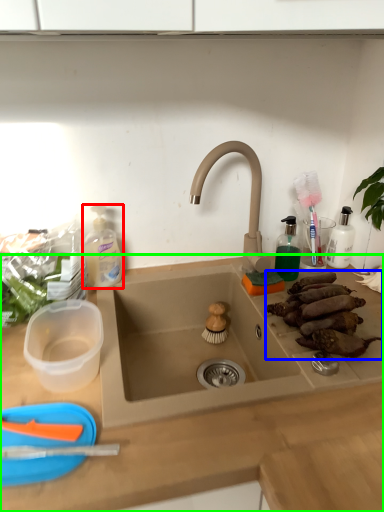
Question: Which is nearer to the cleaning product (highlighted by a red box)? food (highlighted by a blue box) or countertop (highlighted by a green box).

Choices:
 (A) food
 (B) countertop

Answer: (B)